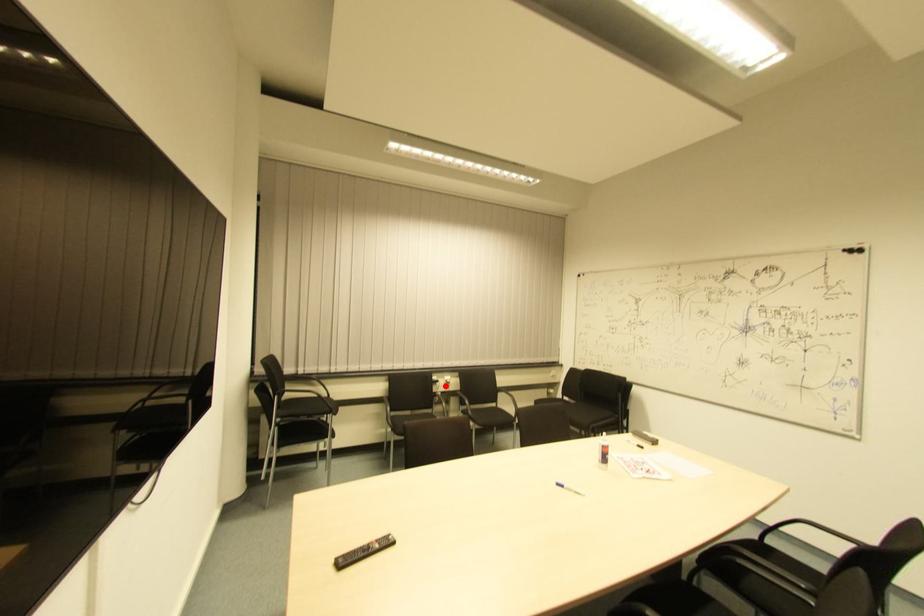
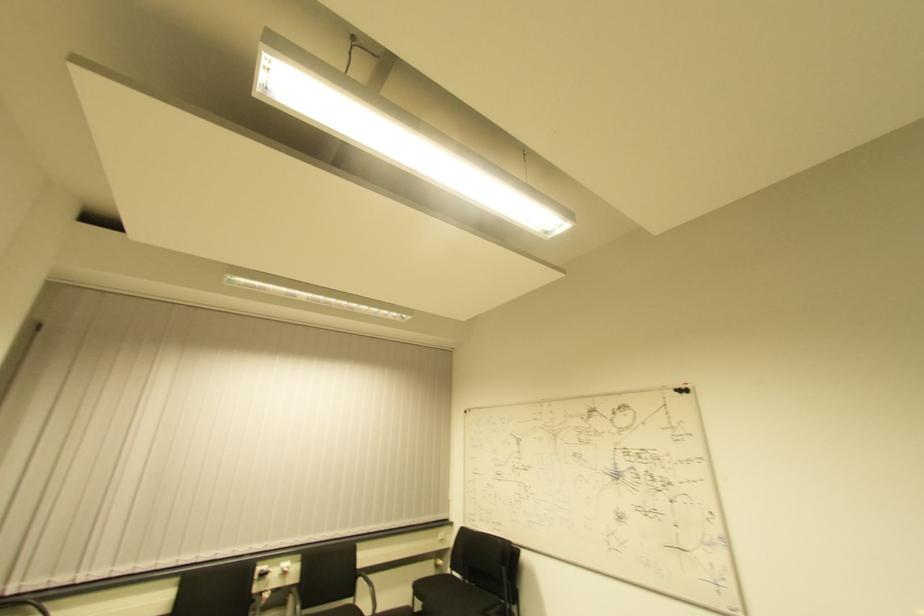
Question: I am providing you with two images of the same scene from different viewpoints. In image1, a red point is highlighted. Considering the same 3D point in image2, which of the following is correct?

Choices:
 (A) It is closer
 (B) It is farther

Answer: (A)